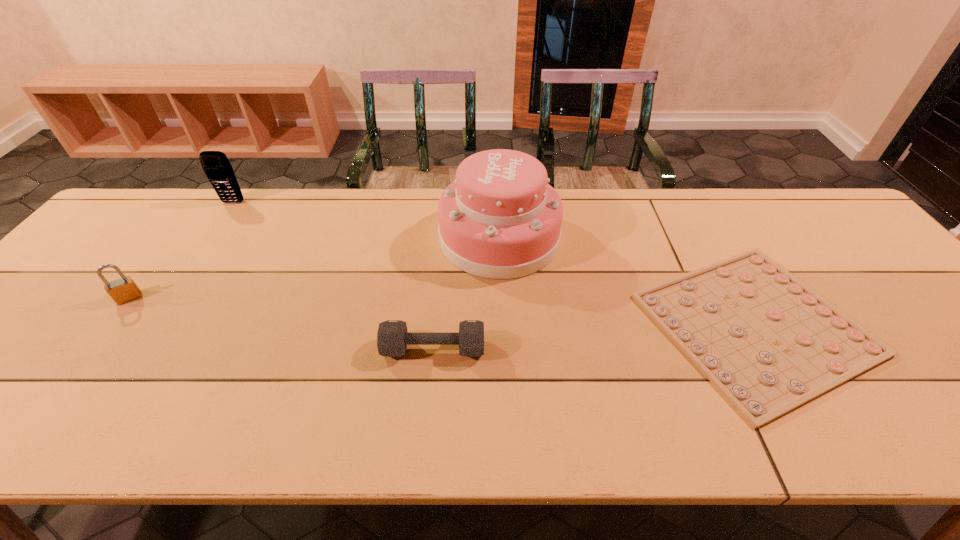
This screenshot has width=960, height=540. I want to click on unoccupied position between the gameboard and the second shortest object, so click(x=594, y=336).

The height and width of the screenshot is (540, 960). Find the location of `object that can be found as the fourth closest to the padlock`. object that can be found as the fourth closest to the padlock is located at coordinates (769, 343).

This screenshot has width=960, height=540. Find the location of `the third closest object to the rightmost object`. the third closest object to the rightmost object is located at coordinates (216, 166).

Identify the location of blank space that satisfies the following two spatial constraints: 1. on the screen of the fourth object from right to left; 2. on the right side of the dumbbell. (135, 348).

At what (x,y) coordinates should I click in order to perform the action: click on free location that satisfies the following two spatial constraints: 1. on the front side of the birthday cake; 2. on the right side of the shortest object. Please return your answer as a coordinate pair (x, y). The height and width of the screenshot is (540, 960). Looking at the image, I should click on (503, 324).

Locate an element on the screen. free space that satisfies the following two spatial constraints: 1. on the screen of the second object from left to right; 2. on the left side of the second shortest object is located at coordinates (135, 348).

This screenshot has width=960, height=540. Find the location of `free location that satisfies the following two spatial constraints: 1. on the back side of the third tallest object; 2. on the right side of the birthday cake`. free location that satisfies the following two spatial constraints: 1. on the back side of the third tallest object; 2. on the right side of the birthday cake is located at coordinates (175, 238).

The width and height of the screenshot is (960, 540). In order to click on vacant point that satisfies the following two spatial constraints: 1. on the screen of the cellular telephone; 2. on the left side of the shortest object in this screenshot , I will do `click(151, 324)`.

This screenshot has height=540, width=960. I want to click on free space that satisfies the following two spatial constraints: 1. on the screen of the shortest object; 2. on the left side of the second tallest object, so click(x=151, y=324).